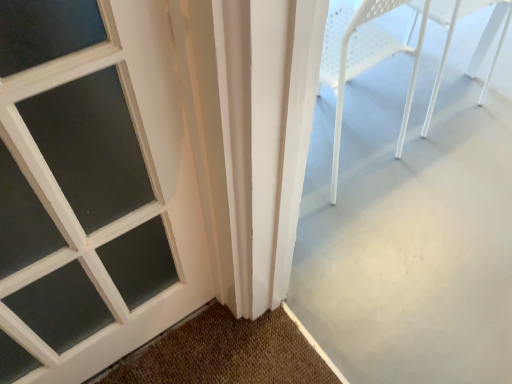
Image resolution: width=512 pixels, height=384 pixels. Describe the element at coordinates (477, 45) in the screenshot. I see `white plastic chair at right` at that location.

Locate an element on the screen. white plastic chair at right is located at coordinates (477, 45).

Identify the location of white plastic chair at right. (477, 45).